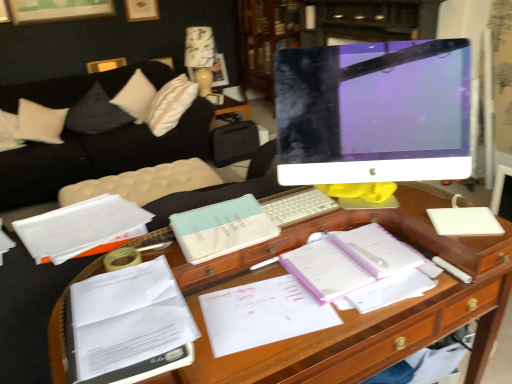
Question: From a real-world perspective, is purple spiral notebook at center over wooden desk at center?

Choices:
 (A) no
 (B) yes

Answer: (B)

Question: From the image's perspective, is purple spiral notebook at center below wooden desk at center?

Choices:
 (A) yes
 (B) no

Answer: (B)

Question: Does purple spiral notebook at center have a greater height compared to wooden desk at center?

Choices:
 (A) yes
 (B) no

Answer: (B)

Question: Is purple spiral notebook at center facing away from wooden desk at center?

Choices:
 (A) no
 (B) yes

Answer: (B)

Question: Is purple spiral notebook at center facing towards wooden desk at center?

Choices:
 (A) no
 (B) yes

Answer: (A)

Question: Considering the relative sizes of purple spiral notebook at center and wooden desk at center in the image provided, is purple spiral notebook at center bigger than wooden desk at center?

Choices:
 (A) yes
 (B) no

Answer: (B)

Question: Is white soft pillow at upper left, which ranks as the 2th pillow in left-to-right order, shorter than white paper at left, the first book from the back?

Choices:
 (A) yes
 (B) no

Answer: (B)

Question: Is white soft pillow at upper left, which ranks as the 2th pillow in left-to-right order, bigger than white paper at left, the first book from the back?

Choices:
 (A) no
 (B) yes

Answer: (B)

Question: Can you see white soft pillow at upper left, placed as the first pillow when sorted from right to left, touching white paper at left, which appears as the 3th book when viewed from the front?

Choices:
 (A) no
 (B) yes

Answer: (A)

Question: Is white soft pillow at upper left, placed as the first pillow when sorted from right to left, aimed at white paper at left, the first book from the back?

Choices:
 (A) no
 (B) yes

Answer: (B)

Question: Is white soft pillow at upper left, placed as the first pillow when sorted from right to left, far away from white paper at left, the first book from the back?

Choices:
 (A) no
 (B) yes

Answer: (B)

Question: From the image's perspective, is white soft pillow at upper left, placed as the first pillow when sorted from right to left, on top of white paper at left, which appears as the 3th book when viewed from the front?

Choices:
 (A) yes
 (B) no

Answer: (A)

Question: Is white paper at left, which appears as the 3th book when viewed from the front, beside white glossy computer monitor at center?

Choices:
 (A) no
 (B) yes

Answer: (A)